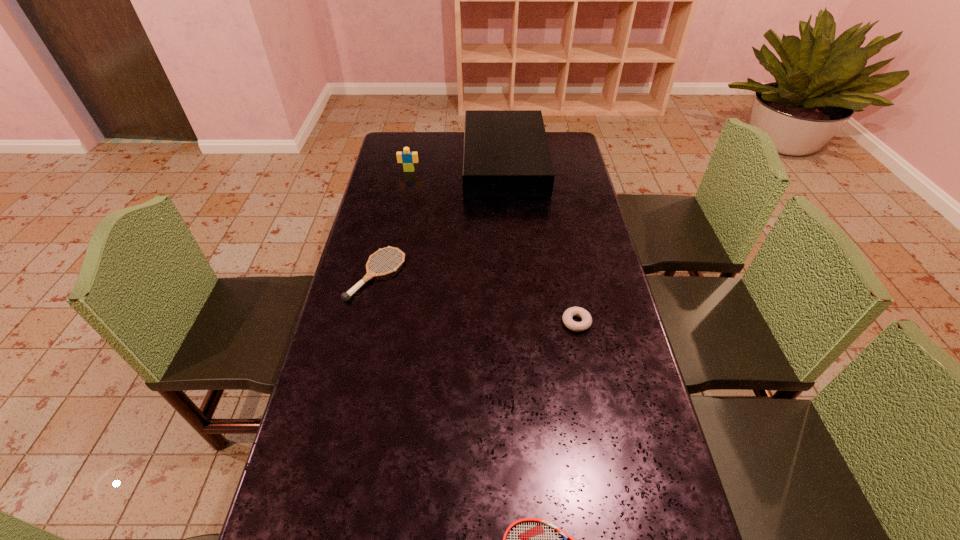
Locate an element on the screen. The height and width of the screenshot is (540, 960). CD player is located at coordinates (506, 154).

This screenshot has width=960, height=540. Find the location of `Lego`. Lego is located at coordinates (408, 158).

At what (x,y) coordinates should I click in order to perform the action: click on the farther tennis racket. Please return your answer as a coordinate pair (x, y). Looking at the image, I should click on point(346,296).

Locate an element on the screen. The width and height of the screenshot is (960, 540). the third farthest object is located at coordinates (346, 296).

This screenshot has height=540, width=960. Identify the location of the second nearest object. (586, 322).

Identify the location of vacant space located at the front of the CD player for disc insertion. The image size is (960, 540). (402, 163).

This screenshot has width=960, height=540. In order to click on blank area located 0.060m at the front of the CD player for disc insertion in this screenshot , I will do `click(450, 163)`.

The height and width of the screenshot is (540, 960). Identify the location of free space located 0.330m at the front of the CD player for disc insertion. (385, 163).

Where is `vacant space positioned on the face of the Lego`? vacant space positioned on the face of the Lego is located at coordinates (404, 197).

Identify the location of vacant point located 0.360m on the front of the third farthest object. The width and height of the screenshot is (960, 540). (344, 418).